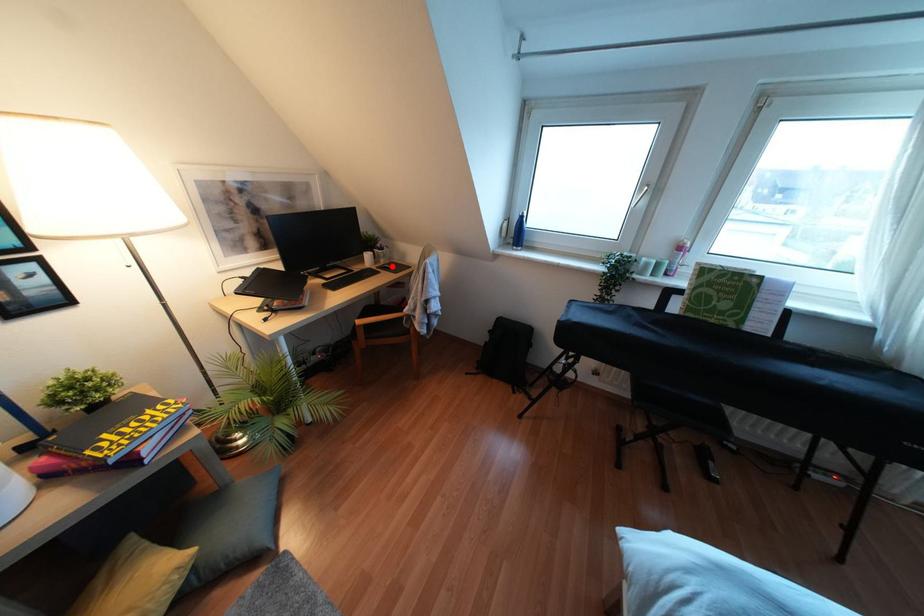
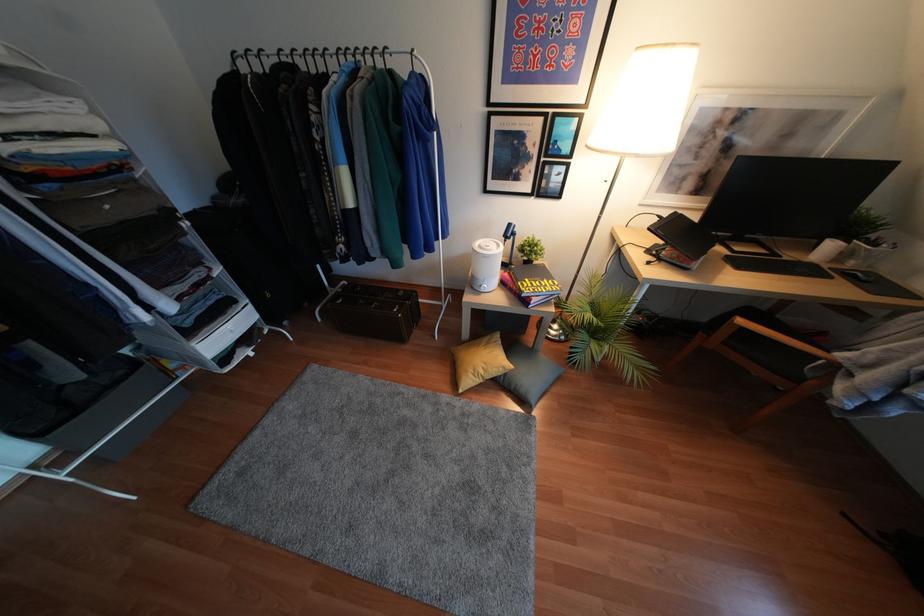
Locate, in the second image, the point that corresponds to the highlighted location in the first image.

(868, 281)